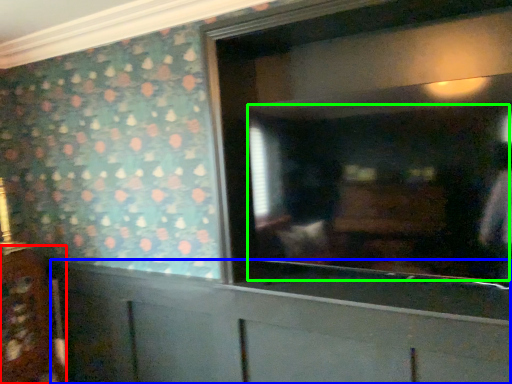
Question: Which object is positioned closest to cabinetry (highlighted by a red box)? Select from cabinetry (highlighted by a blue box) and mirror (highlighted by a green box).

Choices:
 (A) cabinetry
 (B) mirror

Answer: (A)